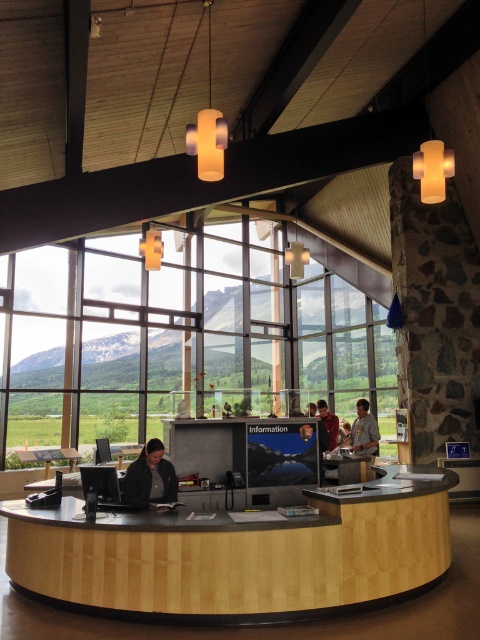
What do you see at coordinates (180, 336) in the screenshot? I see `transparent glass window at center` at bounding box center [180, 336].

Can you confirm if transparent glass window at center is positioned to the right of matte red shirt at center?

Incorrect, transparent glass window at center is not on the right side of matte red shirt at center.

The width and height of the screenshot is (480, 640). Describe the element at coordinates (180, 336) in the screenshot. I see `transparent glass window at center` at that location.

I want to click on transparent glass window at center, so click(180, 336).

Can you confirm if stone textured pillar at right is thinner than light brown leather jacket at center?

No, stone textured pillar at right is not thinner than light brown leather jacket at center.

Does stone textured pillar at right have a greater height compared to light brown leather jacket at center?

Indeed, stone textured pillar at right has a greater height compared to light brown leather jacket at center.

Does point (427, 260) come behind point (372, 416)?

Yes, point (427, 260) is farther from viewer.

Locate an element on the screen. The width and height of the screenshot is (480, 640). stone textured pillar at right is located at coordinates (434, 314).

Is matte black monitor at center thinner than light brown leather jacket at center?

No, matte black monitor at center is not thinner than light brown leather jacket at center.

Where is `matte black monitor at center`? This screenshot has height=640, width=480. matte black monitor at center is located at coordinates (249, 456).

The image size is (480, 640). What are the coordinates of `matte black monitor at center` in the screenshot? It's located at (249, 456).